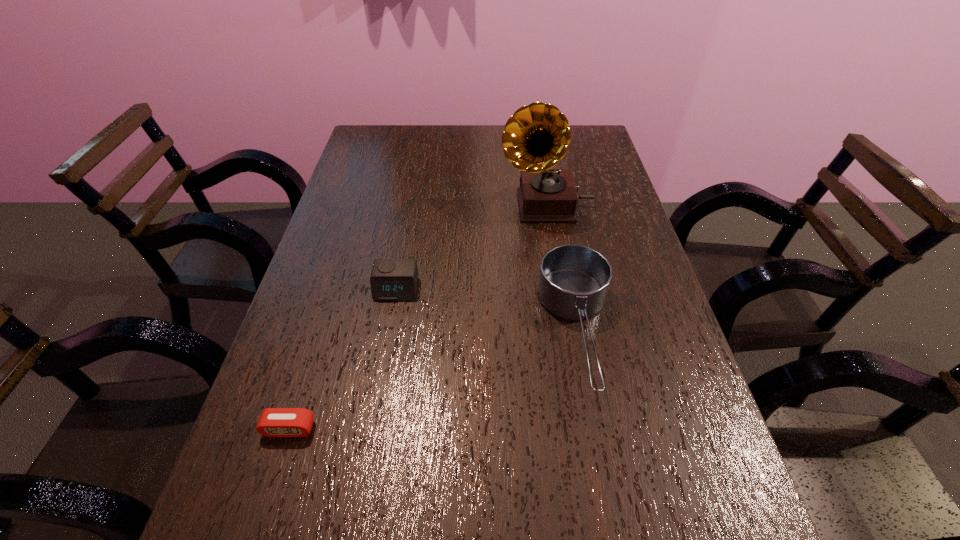
You are a GUI agent. You are given a task and a screenshot of the screen. Output one action in this format:
    pyautogui.click(x=<x>, y=<y>)
    Task: Click on the vacant area located 0.200m with the handle extending from one side of the saucepan
    The width and height of the screenshot is (960, 540).
    Given the screenshot: What is the action you would take?
    pyautogui.click(x=615, y=530)

This screenshot has width=960, height=540. What are the coordinates of `vacant space located 0.230m on the front-facing side of the taller alarm clock` in the screenshot? It's located at (377, 393).

Identify the location of vacant region located 0.060m on the front-facing side of the shorter alarm clock. (276, 472).

You are a GUI agent. You are given a task and a screenshot of the screen. Output one action in this format:
    pyautogui.click(x=<x>, y=<y>)
    Task: Click on the object at the left edge
    The width and height of the screenshot is (960, 540).
    Given the screenshot: What is the action you would take?
    pyautogui.click(x=274, y=422)

The height and width of the screenshot is (540, 960). I want to click on phonograph record located in the right edge section of the desktop, so click(536, 137).

Identify the location of saucepan that is at the right edge. This screenshot has width=960, height=540. (574, 280).

This screenshot has width=960, height=540. In order to click on vacant region at the far edge of the desktop in this screenshot , I will do [x=493, y=125].

The image size is (960, 540). I want to click on blank area at the left edge, so pyautogui.click(x=311, y=297).

I want to click on vacant position at the right edge of the desktop, so click(x=666, y=377).

This screenshot has width=960, height=540. In the image, there is a desktop. In order to click on vacant area at the far left corner in this screenshot , I will do `click(370, 143)`.